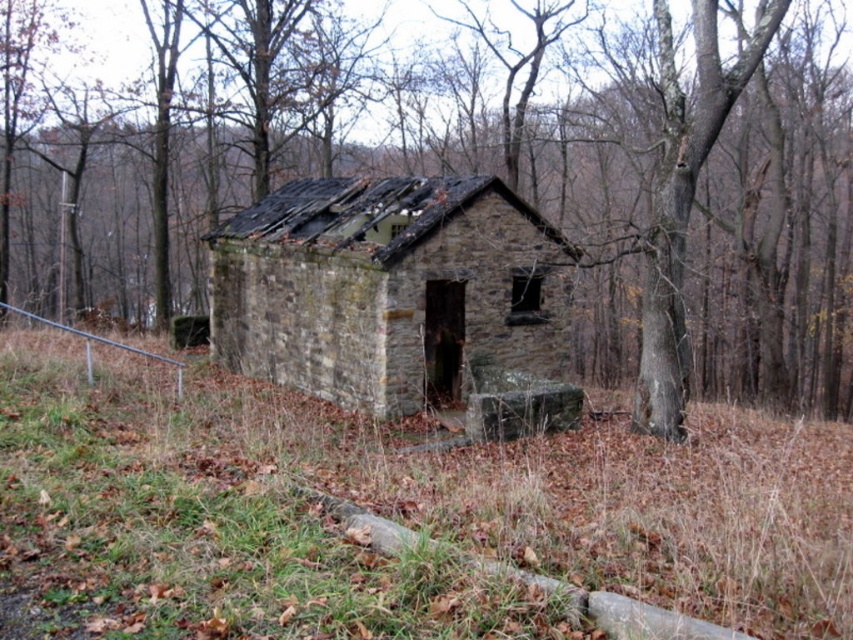
Question: Does brown rough bark tree at center appear under rusty stone hut at center?

Choices:
 (A) no
 (B) yes

Answer: (A)

Question: Can you confirm if brown rough bark tree at center is smaller than rusty stone hut at center?

Choices:
 (A) no
 (B) yes

Answer: (A)

Question: Is brown rough bark tree at center positioned at the back of rusty stone hut at center?

Choices:
 (A) yes
 (B) no

Answer: (B)

Question: Which object is closer to the camera taking this photo?

Choices:
 (A) rusty stone hut at center
 (B) brown rough bark tree at center

Answer: (B)

Question: Which of the following is the farthest from the observer?

Choices:
 (A) (635, 196)
 (B) (399, 349)

Answer: (A)